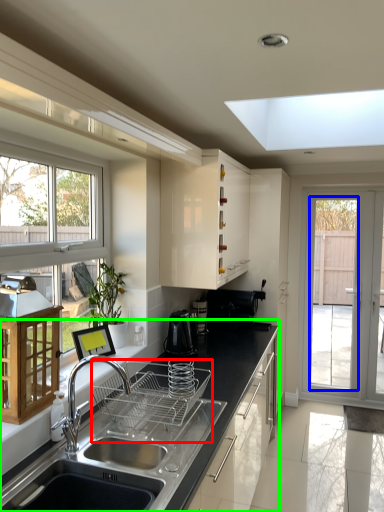
Question: Considering the real-world distances, which object is farthest from appliance (highlighted by a red box)? screen door (highlighted by a blue box) or countertop (highlighted by a green box)?

Choices:
 (A) screen door
 (B) countertop

Answer: (A)